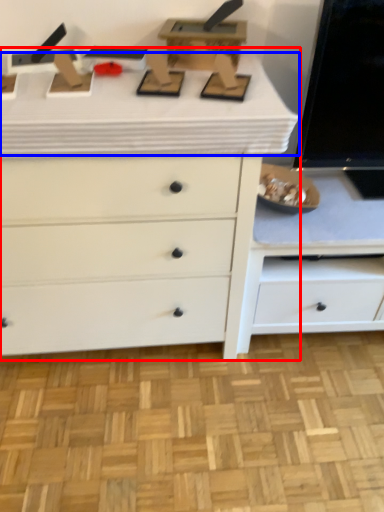
Question: Which object is further to the camera taking this photo, chest of drawers (highlighted by a red box) or counter top (highlighted by a blue box)?

Choices:
 (A) chest of drawers
 (B) counter top

Answer: (A)